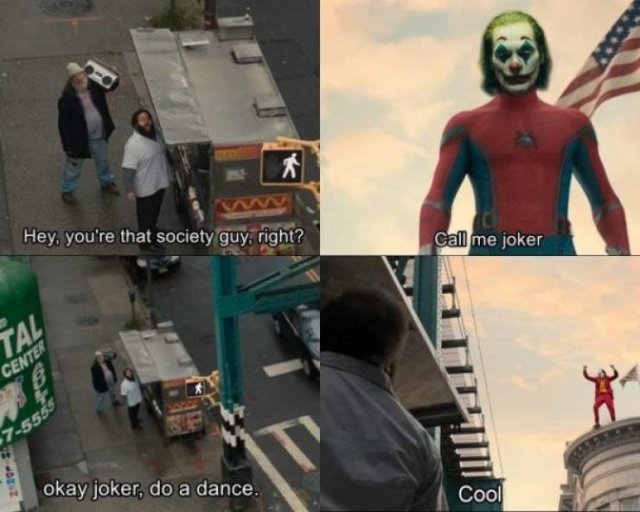
You are a GUI agent. You are given a task and a screenshot of the screen. Output one action in this format:
    pyautogui.click(x=<x>, y=<y>)
    Task: Click on the chest
    
    Given the screenshot: What is the action you would take?
    pyautogui.click(x=528, y=178)